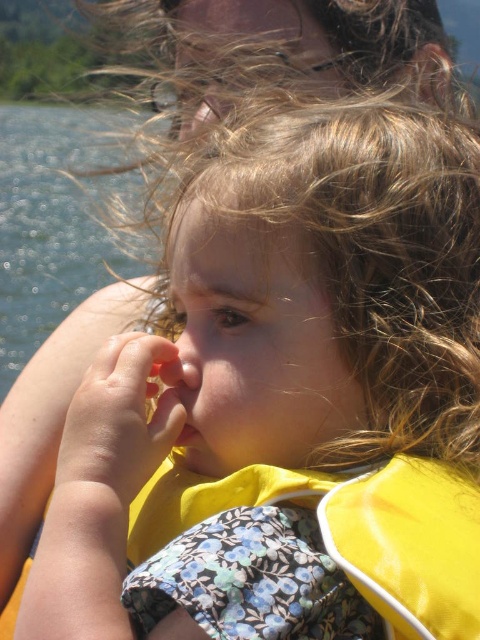
Who is positioned more to the left, yellow fabric life jacket at center or smooth flesh nose at center?

smooth flesh nose at center is more to the left.

Which is above, yellow fabric life jacket at center or smooth flesh nose at center?

Positioned higher is smooth flesh nose at center.

Locate an element on the screen. The image size is (480, 640). yellow fabric life jacket at center is located at coordinates (350, 531).

Which is more to the right, clear water at left or smooth flesh nose at center?

smooth flesh nose at center

Which is above, clear water at left or smooth flesh nose at center?

Positioned higher is clear water at left.

Is point (133, 180) more distant than point (164, 358)?

Yes, point (133, 180) is farther from viewer.

The height and width of the screenshot is (640, 480). I want to click on clear water at left, so click(x=52, y=221).

Is yellow fabric life jacket at center to the left of clear water at left from the viewer's perspective?

No, yellow fabric life jacket at center is not to the left of clear water at left.

Which is more to the left, yellow fabric life jacket at center or clear water at left?

From the viewer's perspective, clear water at left appears more on the left side.

The width and height of the screenshot is (480, 640). Find the location of `yellow fabric life jacket at center`. yellow fabric life jacket at center is located at coordinates (350, 531).